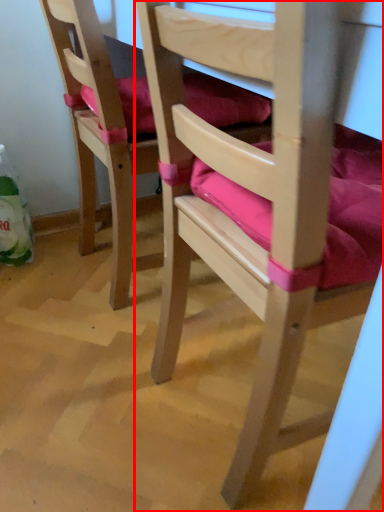
Question: Where is chair (annotated by the red box) located in relation to chair in the image?

Choices:
 (A) right
 (B) left

Answer: (A)